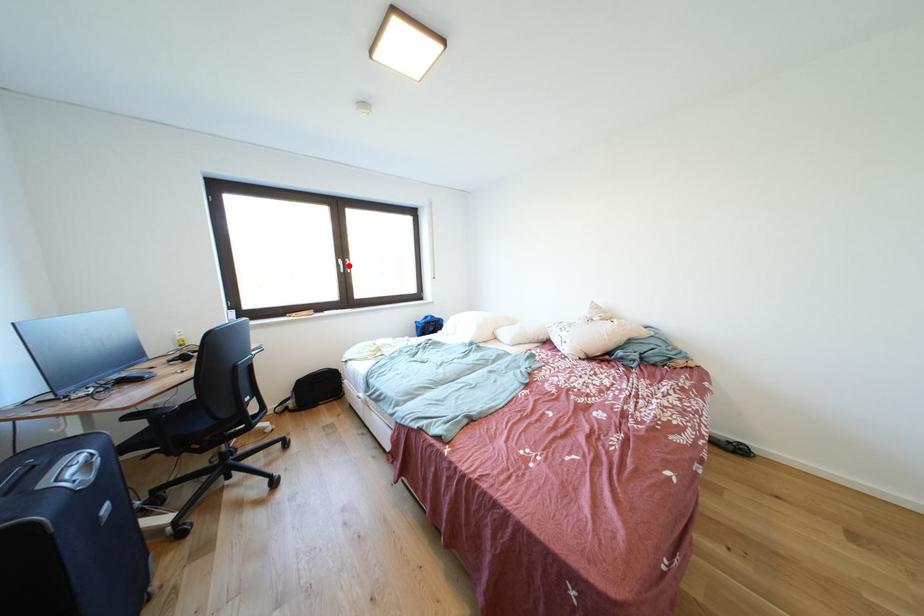
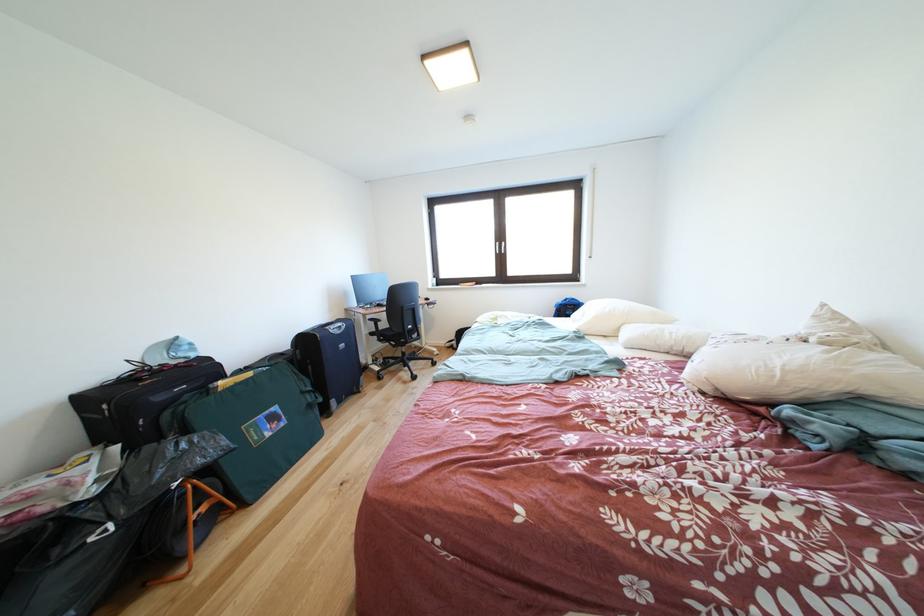
Question: I am providing you with two images of the same scene from different viewpoints. A red point is marked on the first image. At the location where the point appears in image 1, is it still visible in image 2?

Choices:
 (A) Yes
 (B) No

Answer: (A)